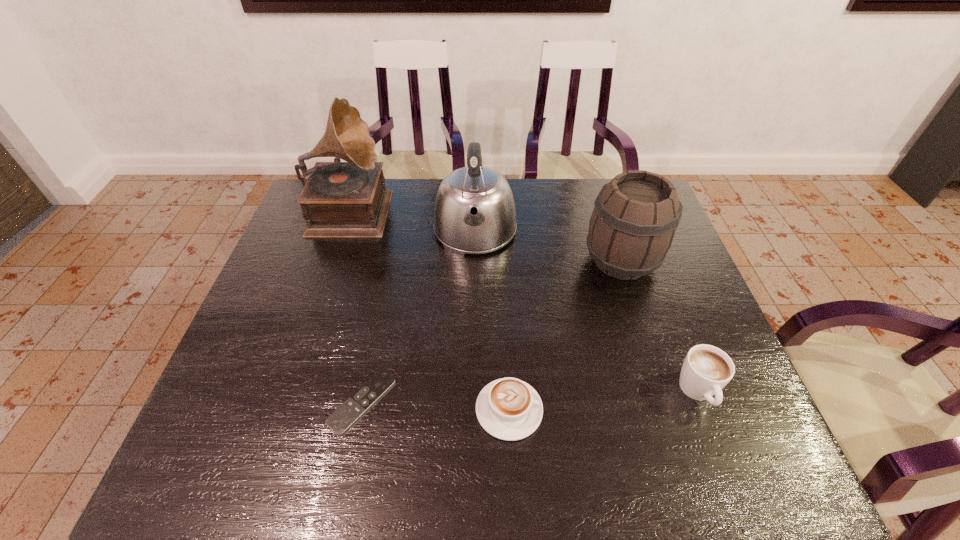
This screenshot has height=540, width=960. I want to click on the tallest object, so click(x=348, y=199).

Find the location of a particular element. kettle is located at coordinates (474, 213).

In order to click on the fourth shortest object in this screenshot , I will do `click(632, 226)`.

Identify the location of the right cappuccino. This screenshot has height=540, width=960. (706, 370).

At what (x,y) coordinates should I click in order to perform the action: click on the third shortest object. Please return your answer as a coordinate pair (x, y). The width and height of the screenshot is (960, 540). Looking at the image, I should click on (706, 370).

This screenshot has height=540, width=960. I want to click on the shorter cappuccino, so click(509, 409).

Locate an element on the screen. This screenshot has height=540, width=960. the left cappuccino is located at coordinates pos(509,409).

Find the location of a particular element. remote control is located at coordinates (357, 404).

Where is `free space located 0.240m from the horn of the tallest object`? Image resolution: width=960 pixels, height=540 pixels. free space located 0.240m from the horn of the tallest object is located at coordinates (465, 208).

Where is `vacant space located on the spout of the kettle`? This screenshot has width=960, height=540. vacant space located on the spout of the kettle is located at coordinates (474, 285).